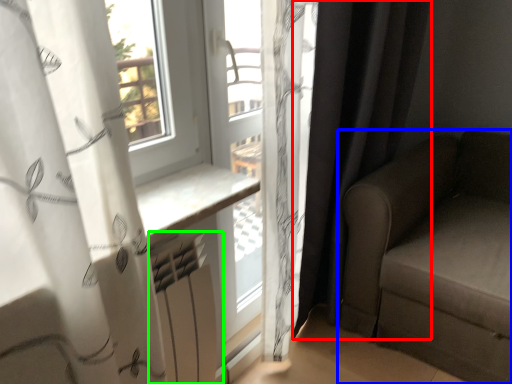
Question: Based on their relative distances, which object is nearer to curtain (highlighted by a red box)? Choose from studio couch (highlighted by a blue box) and radiator (highlighted by a green box).

Choices:
 (A) studio couch
 (B) radiator

Answer: (A)